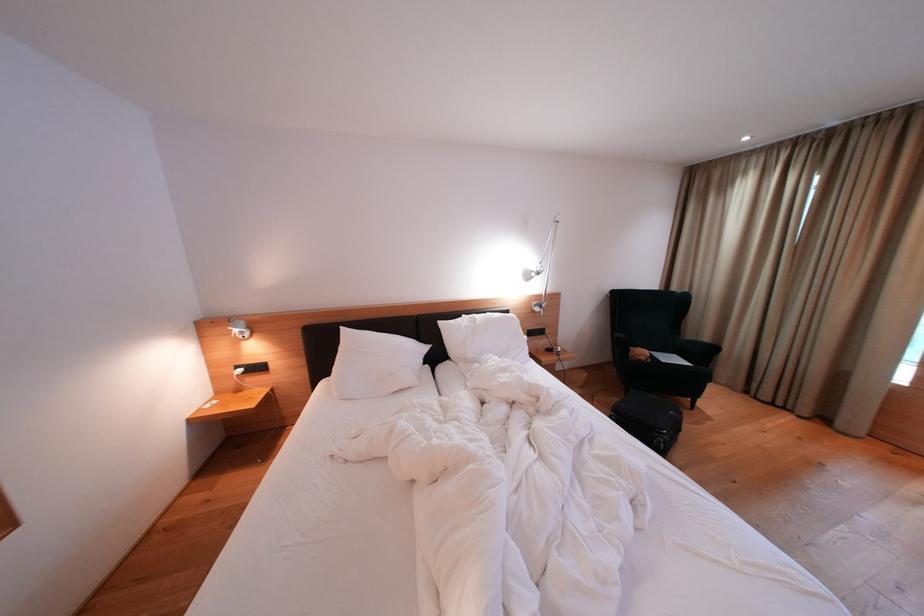
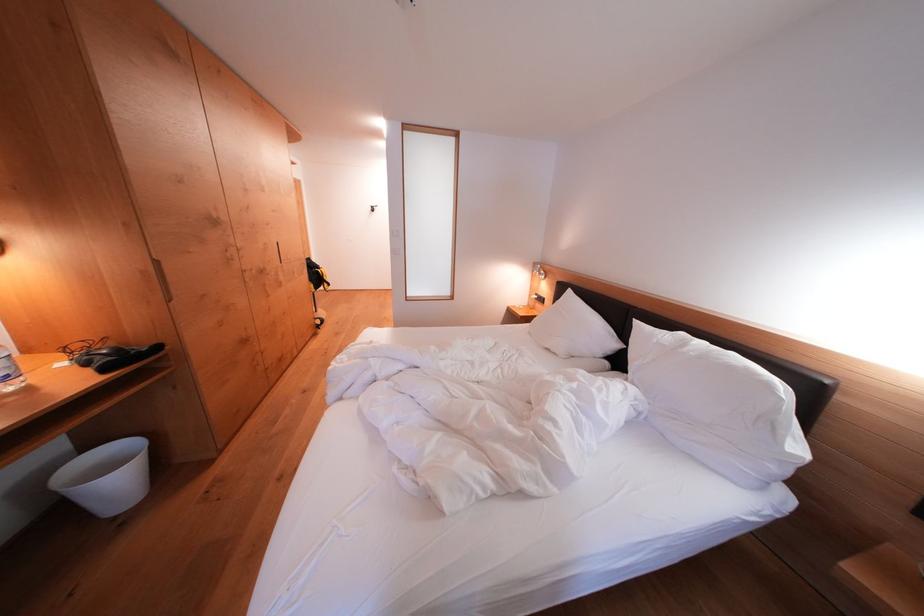
Where in the second image is the point corresponding to (225,397) from the first image?

(536, 310)